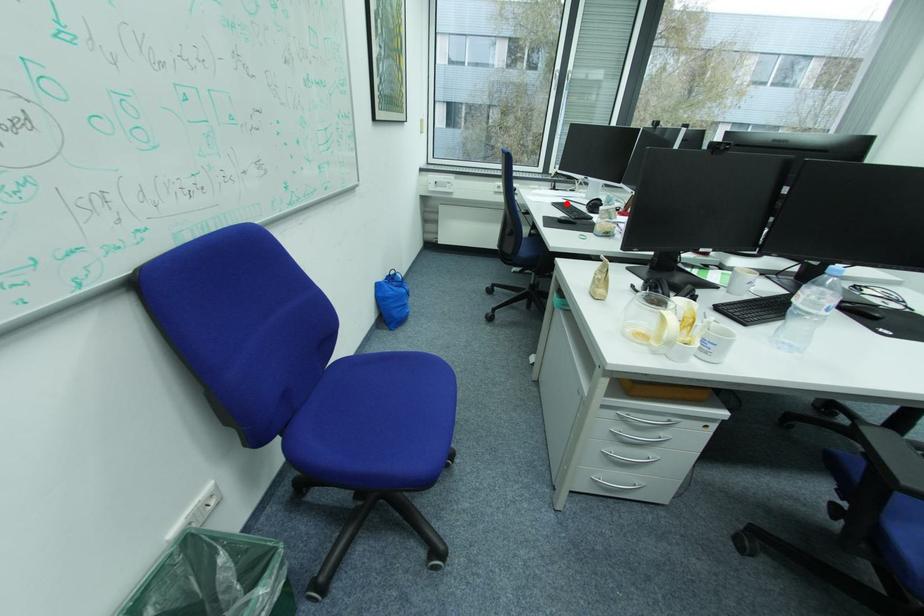
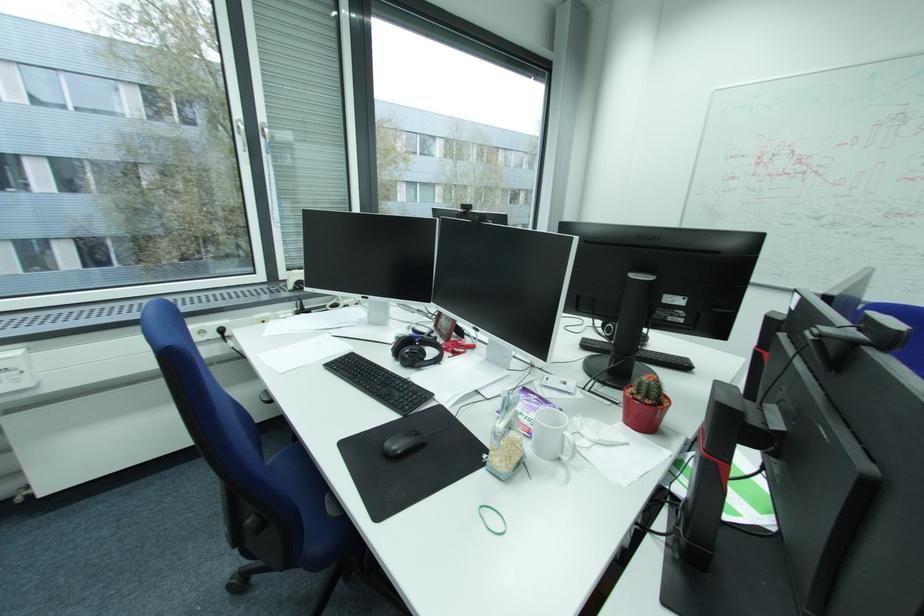
Locate, in the second image, the point that corresponds to the highlighted location in the first image.

(345, 361)